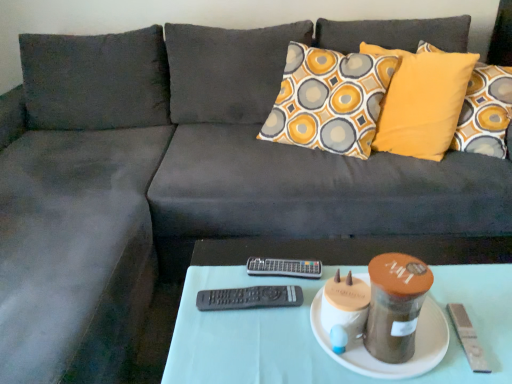
Where is `free space to the right of white ceramic plate at center`? The width and height of the screenshot is (512, 384). free space to the right of white ceramic plate at center is located at coordinates coord(473,295).